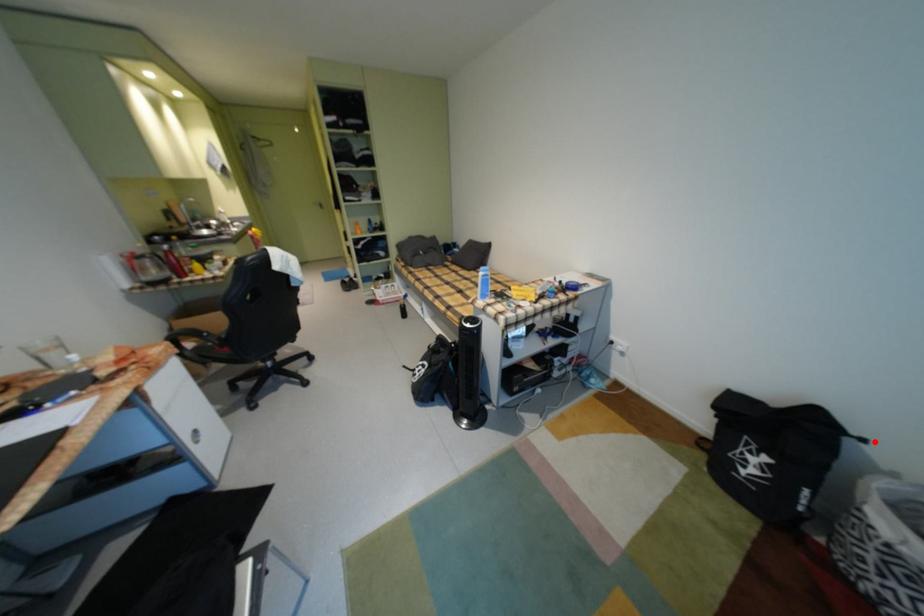
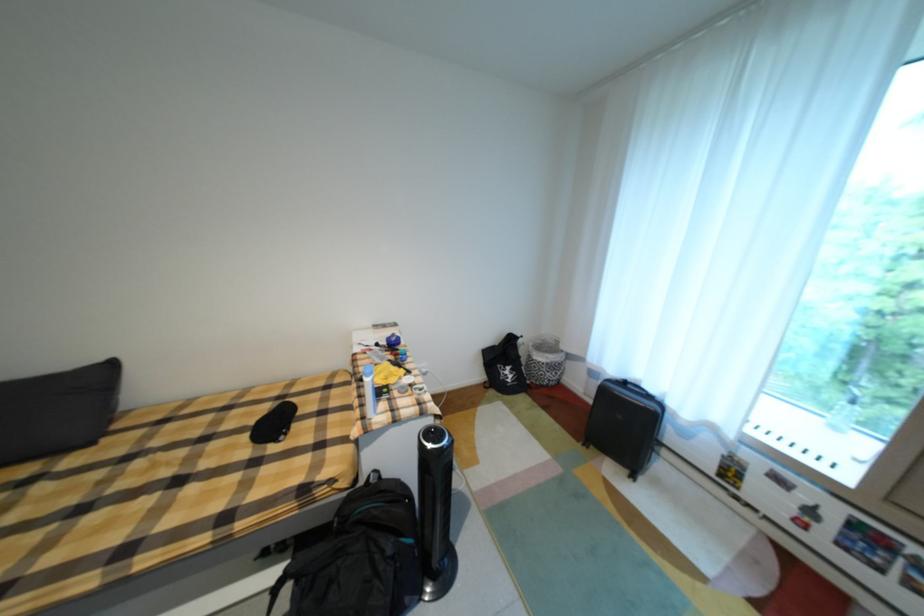
Question: I am providing you with two images of the same scene from different viewpoints. In image1, a red point is highlighted. Considering the same 3D point in image2, which of the following is correct?

Choices:
 (A) It is closer
 (B) It is farther

Answer: (B)